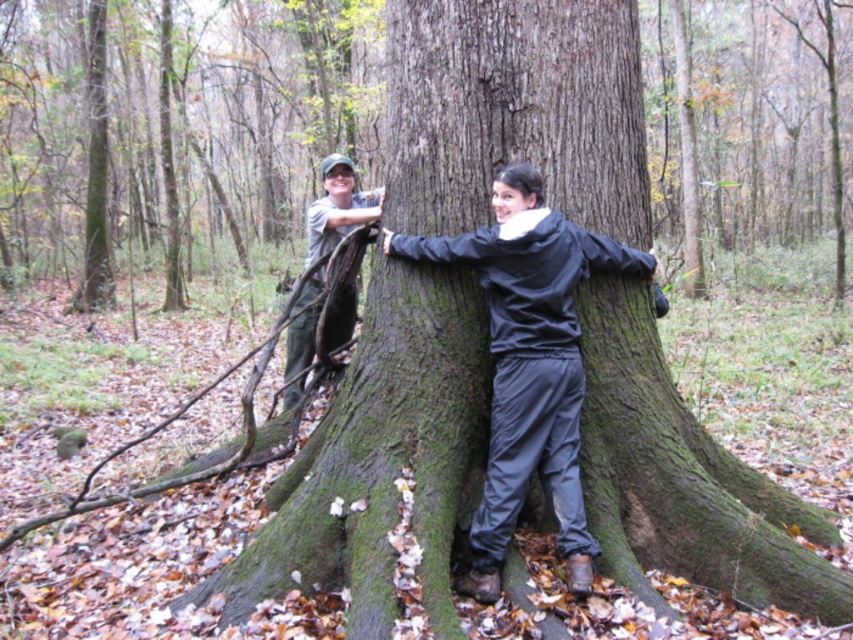
Can you confirm if matte gray jacket at center is thinner than brushed metal branch at left?

No.

Image resolution: width=853 pixels, height=640 pixels. Identify the location of matte gray jacket at center. (527, 365).